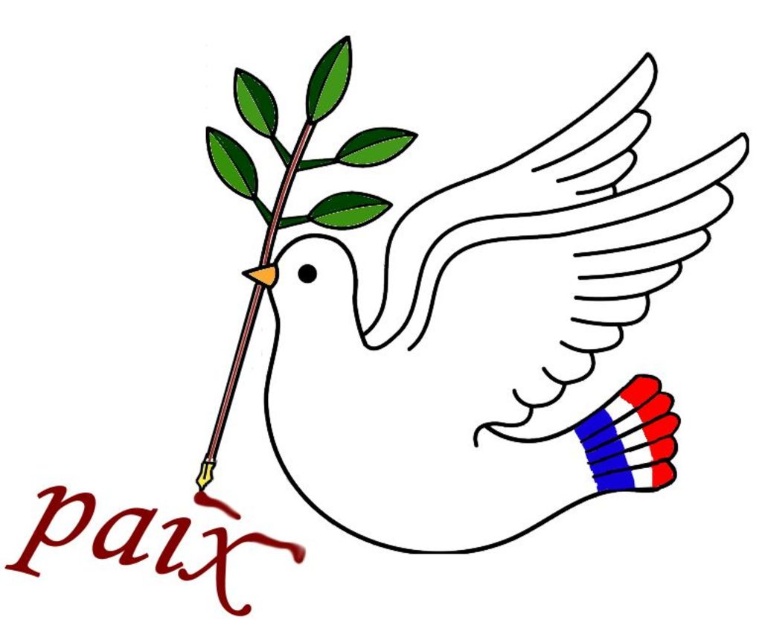
Question: Is white matte dove at center positioned behind green leafy branch at center?

Choices:
 (A) no
 (B) yes

Answer: (A)

Question: Considering the relative positions of white matte dove at center and green leafy branch at center in the image provided, where is white matte dove at center located with respect to green leafy branch at center?

Choices:
 (A) below
 (B) above

Answer: (A)

Question: Can you confirm if white matte dove at center is wider than green leafy branch at center?

Choices:
 (A) no
 (B) yes

Answer: (B)